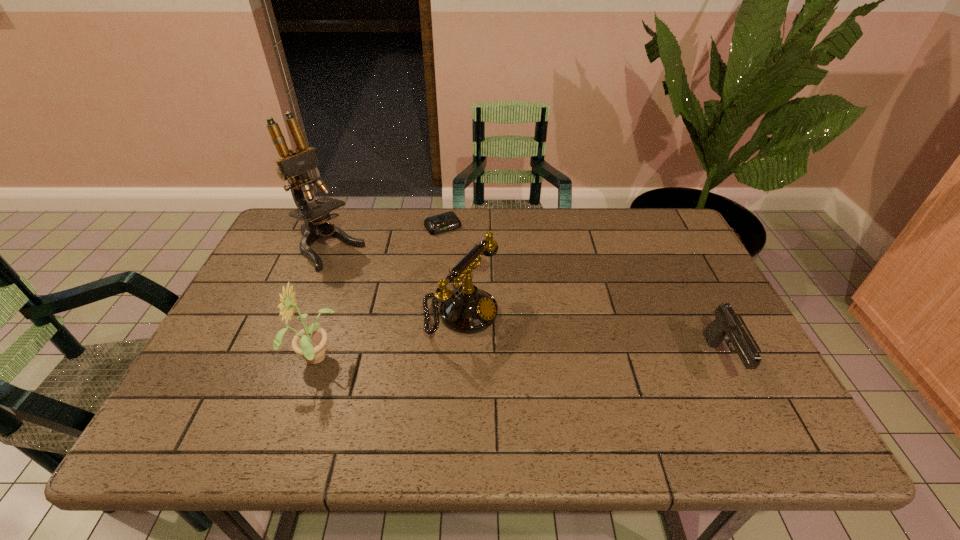
Find the location of a particular element. The width and height of the screenshot is (960, 540). sunflower is located at coordinates (310, 342).

Find the location of `the rightmost object`. the rightmost object is located at coordinates (726, 323).

This screenshot has width=960, height=540. Identify the location of pistol. (726, 323).

The image size is (960, 540). What are the coordinates of `microscope` in the screenshot? It's located at (293, 165).

You are a GUI agent. You are given a task and a screenshot of the screen. Output one action in this format:
    pyautogui.click(x=<x>, y=<y>)
    Task: Click on the alarm clock
    Image resolution: width=960 pixels, height=540 pixels.
    Given the screenshot: What is the action you would take?
    pyautogui.click(x=448, y=221)

The width and height of the screenshot is (960, 540). What are the coordinates of `the third shortest object` in the screenshot? It's located at (469, 310).

You are a GUI agent. You are given a task and a screenshot of the screen. Output one action in this format:
    pyautogui.click(x=<x>, y=<y>)
    Task: Click on the vacant region located on the front-facing side of the sunflower
    This screenshot has height=540, width=960.
    Given the screenshot: What is the action you would take?
    pyautogui.click(x=269, y=361)

Find the location of a particular element. This screenshot has height=540, width=960. free space located on the front-facing side of the sunflower is located at coordinates (204, 361).

Find the location of `free point located at the eyepieces of the tallest object`. free point located at the eyepieces of the tallest object is located at coordinates (444, 333).

Find the location of a particular element. This screenshot has height=540, width=960. vacant region located at the eyepieces of the tallest object is located at coordinates (436, 326).